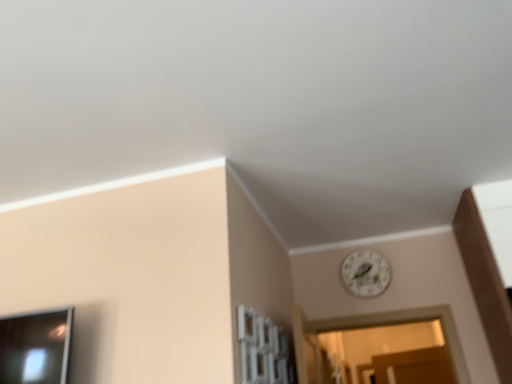
Question: From the image's perspective, is white frosted glass window at center over white floral clock at upper center?

Choices:
 (A) no
 (B) yes

Answer: (A)

Question: Could you tell me if white frosted glass window at center is facing white floral clock at upper center?

Choices:
 (A) yes
 (B) no

Answer: (B)

Question: Is white frosted glass window at center positioned in front of white floral clock at upper center?

Choices:
 (A) yes
 (B) no

Answer: (A)

Question: From a real-world perspective, is white frosted glass window at center on white floral clock at upper center?

Choices:
 (A) no
 (B) yes

Answer: (A)

Question: Is white floral clock at upper center a part of white frosted glass window at center?

Choices:
 (A) no
 (B) yes

Answer: (A)

Question: Does white frosted glass window at center have a lesser height compared to white floral clock at upper center?

Choices:
 (A) no
 (B) yes

Answer: (B)

Question: From a real-world perspective, is white floral clock at upper center on top of white frosted glass window at center?

Choices:
 (A) no
 (B) yes

Answer: (B)

Question: Does white floral clock at upper center turn towards white frosted glass window at center?

Choices:
 (A) yes
 (B) no

Answer: (A)

Question: From the image's perspective, is white floral clock at upper center located beneath white frosted glass window at center?

Choices:
 (A) yes
 (B) no

Answer: (B)

Question: Is white floral clock at upper center located outside white frosted glass window at center?

Choices:
 (A) yes
 (B) no

Answer: (A)

Question: Does white floral clock at upper center have a greater width compared to white frosted glass window at center?

Choices:
 (A) yes
 (B) no

Answer: (B)

Question: Considering the relative positions of white floral clock at upper center and white frosted glass window at center in the image provided, is white floral clock at upper center to the left of white frosted glass window at center from the viewer's perspective?

Choices:
 (A) yes
 (B) no

Answer: (B)

Question: Which is correct: white frosted glass window at center is inside white floral clock at upper center, or outside of it?

Choices:
 (A) outside
 (B) inside

Answer: (A)